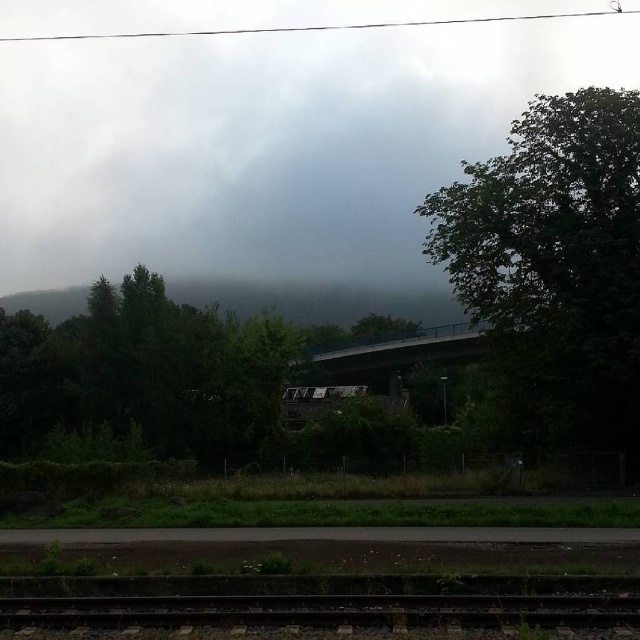
Is smooth concrete train track at bottom above dark gray concrete bridge at center?

No.

Is point (480, 609) in front of point (314, 371)?

Yes, point (480, 609) is closer to viewer.

Is point (68, 596) farther from camera compared to point (390, 340)?

No, (68, 596) is closer to viewer.

Find the location of a particular element. The image size is (640, 640). smooth concrete train track at bottom is located at coordinates (324, 611).

Is smooth concrete train track at bottom closer to the viewer compared to green leafy tree at center?

Yes, it is.

The height and width of the screenshot is (640, 640). What do you see at coordinates (324, 611) in the screenshot?
I see `smooth concrete train track at bottom` at bounding box center [324, 611].

At what (x,y) coordinates should I click in order to perform the action: click on smooth concrete train track at bottom. Please return your answer as a coordinate pair (x, y). Looking at the image, I should click on (324, 611).

Who is higher up, dark gray concrete bridge at center or green leafy tree at center?

Positioned higher is green leafy tree at center.

Is dark gray concrete bridge at center smaller than green leafy tree at center?

No, dark gray concrete bridge at center is not smaller than green leafy tree at center.

Who is more forward, (368, 349) or (369, 340)?

Point (368, 349)

Find the location of a particular element. The width and height of the screenshot is (640, 640). dark gray concrete bridge at center is located at coordinates (392, 353).